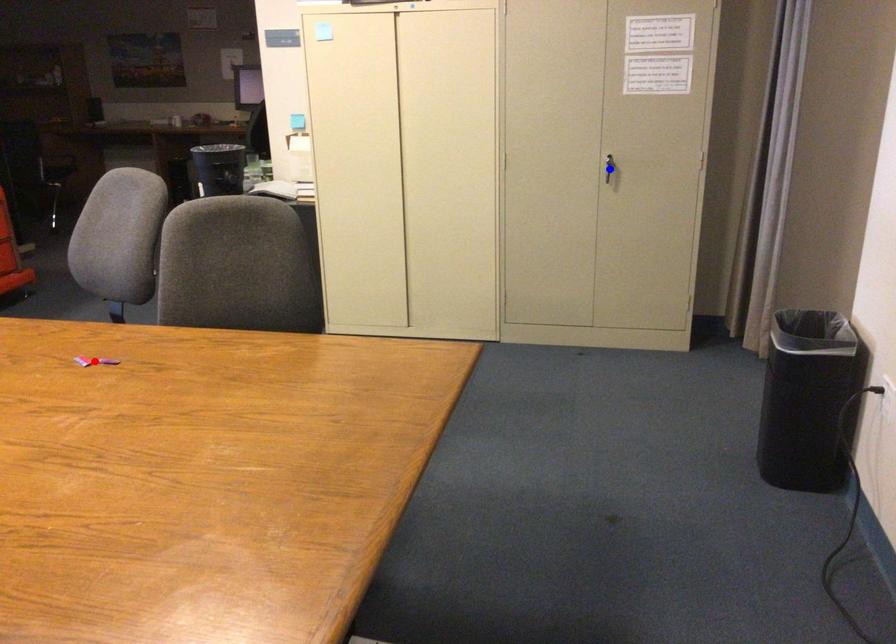
Question: Which of the two points in the image is closer to the camera?

Choices:
 (A) Blue point is closer.
 (B) Red point is closer.

Answer: (B)